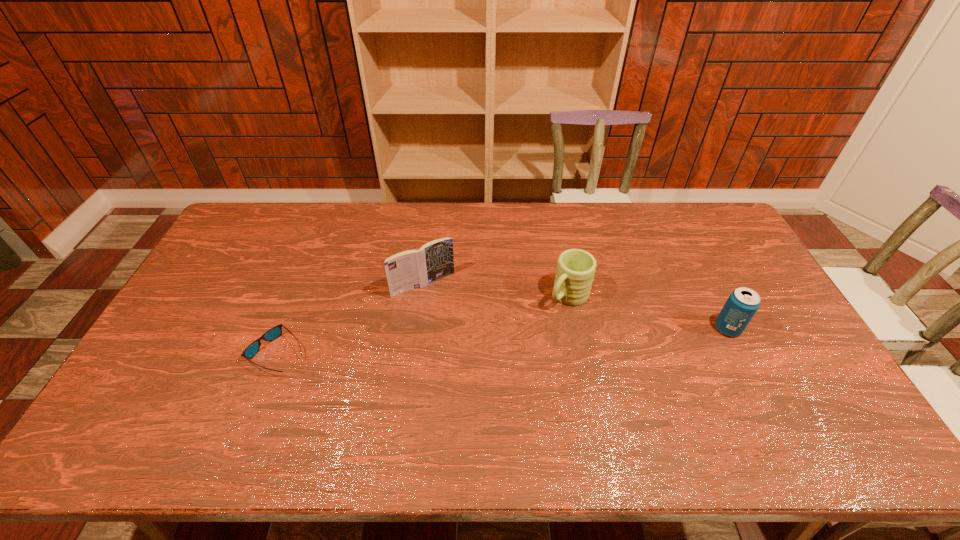
Find the location of a particular element. free location at the far left corner is located at coordinates (246, 240).

I want to click on vacant space at the near left corner of the desktop, so (154, 397).

Where is `free space that is in between the book and the rightmost object`? Image resolution: width=960 pixels, height=540 pixels. free space that is in between the book and the rightmost object is located at coordinates (576, 307).

The image size is (960, 540). What are the coordinates of `vacant area between the second object from right to left and the shortest object` in the screenshot? It's located at (423, 325).

What are the coordinates of `free space between the third object from left to right and the third object from right to left` in the screenshot? It's located at (496, 291).

Locate an element on the screen. The width and height of the screenshot is (960, 540). free space between the shortest object and the mug is located at coordinates (423, 325).

Identify the location of vacant area that lies between the third object from right to left and the third object from left to right. This screenshot has height=540, width=960. (496, 291).

Locate an element on the screen. blank region between the sunglasses and the third object from right to left is located at coordinates (351, 319).

What are the coordinates of `free space between the third object from right to left and the second object from right to left` in the screenshot? It's located at (496, 291).

The width and height of the screenshot is (960, 540). Find the location of `free point between the soda can and the leftmost object`. free point between the soda can and the leftmost object is located at coordinates (503, 341).